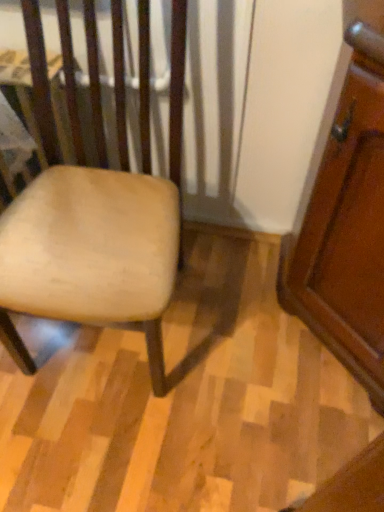
Question: Could you tell me if wooden screen door at right is turned towards light brown wood chair at left?

Choices:
 (A) yes
 (B) no

Answer: (A)

Question: Is light brown wood chair at left surrounded by wooden screen door at right?

Choices:
 (A) yes
 (B) no

Answer: (B)

Question: Considering the relative sizes of wooden screen door at right and light brown wood chair at left in the image provided, is wooden screen door at right shorter than light brown wood chair at left?

Choices:
 (A) yes
 (B) no

Answer: (A)

Question: Is wooden screen door at right far from light brown wood chair at left?

Choices:
 (A) yes
 (B) no

Answer: (B)

Question: From the image's perspective, is wooden screen door at right under light brown wood chair at left?

Choices:
 (A) yes
 (B) no

Answer: (A)

Question: From a real-world perspective, is wooden screen door at right on top of light brown wood chair at left?

Choices:
 (A) no
 (B) yes

Answer: (A)

Question: From a real-world perspective, is light brown wood chair at left positioned over wooden screen door at right based on gravity?

Choices:
 (A) yes
 (B) no

Answer: (A)

Question: Can you confirm if light brown wood chair at left is positioned to the right of wooden screen door at right?

Choices:
 (A) yes
 (B) no

Answer: (B)

Question: Are light brown wood chair at left and wooden screen door at right making contact?

Choices:
 (A) no
 (B) yes

Answer: (A)

Question: Is light brown wood chair at left outside of wooden screen door at right?

Choices:
 (A) no
 (B) yes

Answer: (B)

Question: Is wooden screen door at right completely or partially inside light brown wood chair at left?

Choices:
 (A) yes
 (B) no

Answer: (B)

Question: From the image's perspective, does light brown wood chair at left appear lower than wooden screen door at right?

Choices:
 (A) yes
 (B) no

Answer: (B)

Question: Looking at the image, does wooden screen door at right seem bigger or smaller compared to light brown wood chair at left?

Choices:
 (A) big
 (B) small

Answer: (B)